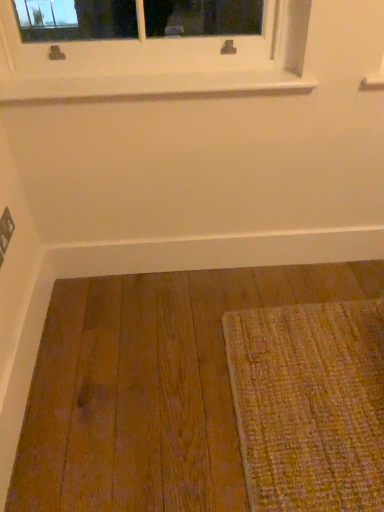
What do you see at coordinates (214, 252) in the screenshot? This screenshot has width=384, height=512. I see `white smooth baseboard at lower center` at bounding box center [214, 252].

The height and width of the screenshot is (512, 384). Find the location of `white smooth baseboard at lower center`. white smooth baseboard at lower center is located at coordinates (214, 252).

Identify the location of white smooth window sill at upper center. Image resolution: width=384 pixels, height=512 pixels. (154, 85).

Describe the element at coordinates (154, 85) in the screenshot. Image resolution: width=384 pixels, height=512 pixels. I see `white smooth window sill at upper center` at that location.

What are the coordinates of `white smooth baseboard at lower center` in the screenshot? It's located at (214, 252).

Does white smooth baseboard at lower center appear on the left side of white smooth window sill at upper center?

Incorrect, white smooth baseboard at lower center is not on the left side of white smooth window sill at upper center.

Based on the photo, which object is further away from the camera taking this photo, white smooth baseboard at lower center or white smooth window sill at upper center?

Positioned behind is white smooth baseboard at lower center.

Which is farther, (x=354, y=232) or (x=142, y=93)?

The point (x=354, y=232) is more distant.

From the image's perspective, does white smooth baseboard at lower center appear lower than white smooth window sill at upper center?

Correct, white smooth baseboard at lower center appears lower than white smooth window sill at upper center in the image.

From a real-world perspective, is white smooth baseboard at lower center beneath white smooth window sill at upper center?

Yes, from a real-world perspective, white smooth baseboard at lower center is below white smooth window sill at upper center.

Can you confirm if white smooth baseboard at lower center is thinner than white smooth window sill at upper center?

Yes.

Is white smooth baseboard at lower center shorter than white smooth window sill at upper center?

Incorrect, the height of white smooth baseboard at lower center does not fall short of that of white smooth window sill at upper center.

Based on the photo, considering the relative sizes of white smooth baseboard at lower center and white smooth window sill at upper center in the image provided, is white smooth baseboard at lower center smaller than white smooth window sill at upper center?

Correct, white smooth baseboard at lower center occupies less space than white smooth window sill at upper center.

Is white smooth baseboard at lower center situated inside white smooth window sill at upper center or outside?

white smooth baseboard at lower center lies outside white smooth window sill at upper center.

Is white smooth baseboard at lower center with white smooth window sill at upper center?

No, white smooth baseboard at lower center is not touching white smooth window sill at upper center.

Is white smooth window sill at upper center at the back of white smooth baseboard at lower center?

No, white smooth window sill at upper center is not at the back of white smooth baseboard at lower center.

How many degrees apart are the facing directions of white smooth baseboard at lower center and white smooth window sill at upper center?

They differ by 0.203 degrees in their facing directions.

In the image, there is a white smooth window sill at upper center. Identify the location of molding below it (from a real-world perspective). (214, 252).

Between white smooth window sill at upper center and white smooth baseboard at lower center, which one appears on the right side from the viewer's perspective?

white smooth baseboard at lower center.

Between white smooth window sill at upper center and white smooth baseboard at lower center, which one is positioned behind?

white smooth baseboard at lower center is further away from the camera.

Considering the points (168, 90) and (329, 239), which point is in front, point (168, 90) or point (329, 239)?

The point (168, 90) is closer to the camera.

From the image's perspective, between white smooth window sill at upper center and white smooth baseboard at lower center, who is located below?

white smooth baseboard at lower center, from the image's perspective.

From a real-world perspective, is white smooth window sill at upper center located beneath white smooth baseboard at lower center?

No.

Can you confirm if white smooth window sill at upper center is wider than white smooth baseboard at lower center?

Indeed, white smooth window sill at upper center has a greater width compared to white smooth baseboard at lower center.

Between white smooth window sill at upper center and white smooth baseboard at lower center, which one has less height?

white smooth window sill at upper center.

Who is bigger, white smooth window sill at upper center or white smooth baseboard at lower center?

Bigger between the two is white smooth window sill at upper center.

Would you say white smooth window sill at upper center is inside or outside white smooth baseboard at lower center?

white smooth window sill at upper center exists outside the volume of white smooth baseboard at lower center.

Are white smooth window sill at upper center and white smooth baseboard at lower center beside each other?

white smooth window sill at upper center is not next to white smooth baseboard at lower center, and they're not touching.

Is white smooth window sill at upper center looking in the opposite direction of white smooth baseboard at lower center?

No.

How different are the orientations of white smooth window sill at upper center and white smooth baseboard at lower center in degrees?

The angular difference between white smooth window sill at upper center and white smooth baseboard at lower center is 0.203 degrees.

Consider the image. How far apart are white smooth window sill at upper center and white smooth baseboard at lower center?

white smooth window sill at upper center and white smooth baseboard at lower center are 66.35 centimeters apart.

I want to click on molding that is under the white smooth window sill at upper center (from a real-world perspective), so click(x=214, y=252).

This screenshot has height=512, width=384. What are the coordinates of `window sill in front of the white smooth baseboard at lower center` in the screenshot? It's located at (154, 85).

Locate an element on the screen. molding on the right side of white smooth window sill at upper center is located at coordinates (214, 252).